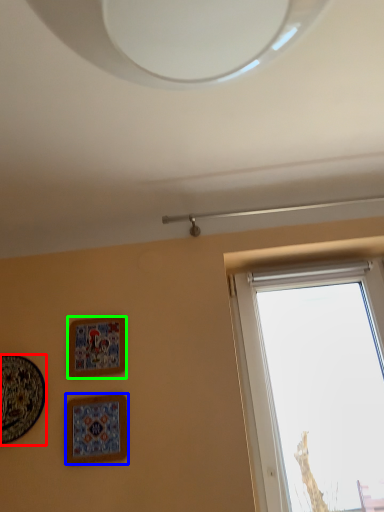
Question: Estimate the real-world distances between objects in this image. Which object is farther from picture frame (highlighted by a red box), picture frame (highlighted by a blue box) or picture frame (highlighted by a green box)?

Choices:
 (A) picture frame
 (B) picture frame

Answer: (B)